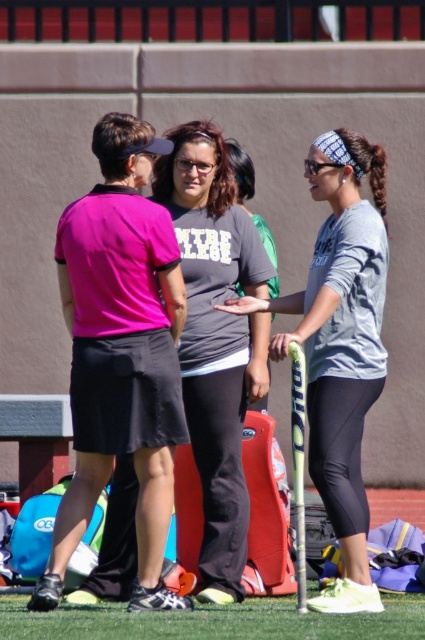
Can you confirm if gray matte tennis racket at center is taller than green artificial turf at lower center?

Yes.

Between point (316, 467) and point (385, 605), which one is positioned behind?

The point (385, 605) is more distant.

Between point (311, 371) and point (235, 618), which one is positioned in front?

Point (235, 618) is more forward.

This screenshot has height=640, width=425. What are the coordinates of `gray matte tennis racket at center` in the screenshot? It's located at (340, 346).

Can you confirm if gray matte tennis racket at center is positioned to the right of matte gray t-shirt at center?

Correct, you'll find gray matte tennis racket at center to the right of matte gray t-shirt at center.

I want to click on gray matte tennis racket at center, so click(340, 346).

Which is in front, point (359, 340) or point (189, 204)?

Point (359, 340) is more forward.

I want to click on gray matte tennis racket at center, so click(340, 346).

Is point (244, 520) more distant than point (226, 620)?

That is True.

Is matte gray t-shirt at center below green artificial turf at lower center?

No.

Locate an element on the screen. matte gray t-shirt at center is located at coordinates (215, 339).

At what (x,y) coordinates should I click in order to perform the action: click on matte gray t-shirt at center. Please return your answer as a coordinate pair (x, y). This screenshot has width=425, height=640. Looking at the image, I should click on (215, 339).